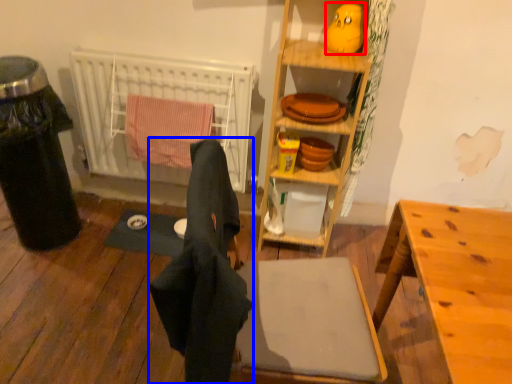
Question: Which object appears closest to the camera in this image, toy (highlighted by a red box) or laundry (highlighted by a blue box)?

Choices:
 (A) toy
 (B) laundry

Answer: (B)